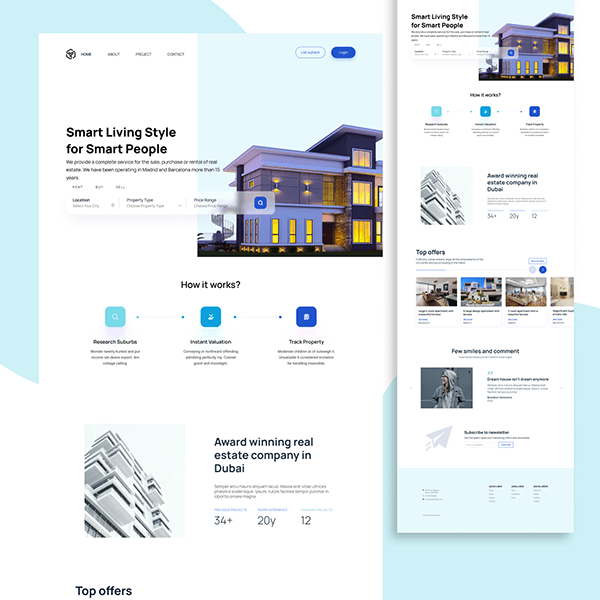
I want to click on light in building, so coord(357,190), coord(360,229).